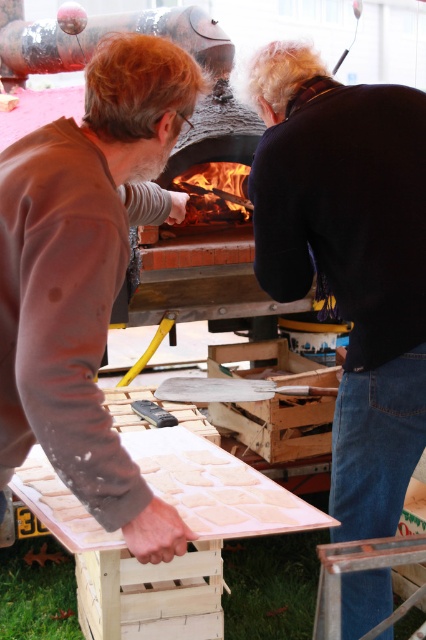
Question: Which point is farther to the camera?

Choices:
 (A) brown matte sweater at left
 (B) black matte shirt at upper right

Answer: (B)

Question: Considering the relative positions of black matte shirt at upper right and brown matte sweater at left in the image provided, where is black matte shirt at upper right located with respect to brown matte sweater at left?

Choices:
 (A) left
 (B) right

Answer: (B)

Question: Can you confirm if black matte shirt at upper right is positioned to the right of brown matte sweater at left?

Choices:
 (A) yes
 (B) no

Answer: (A)

Question: Which point is closer to the camera taking this photo?

Choices:
 (A) tap(20, 368)
 (B) tap(376, 202)

Answer: (A)

Question: Can you confirm if black matte shirt at upper right is positioned to the right of brown matte sweater at left?

Choices:
 (A) no
 (B) yes

Answer: (B)